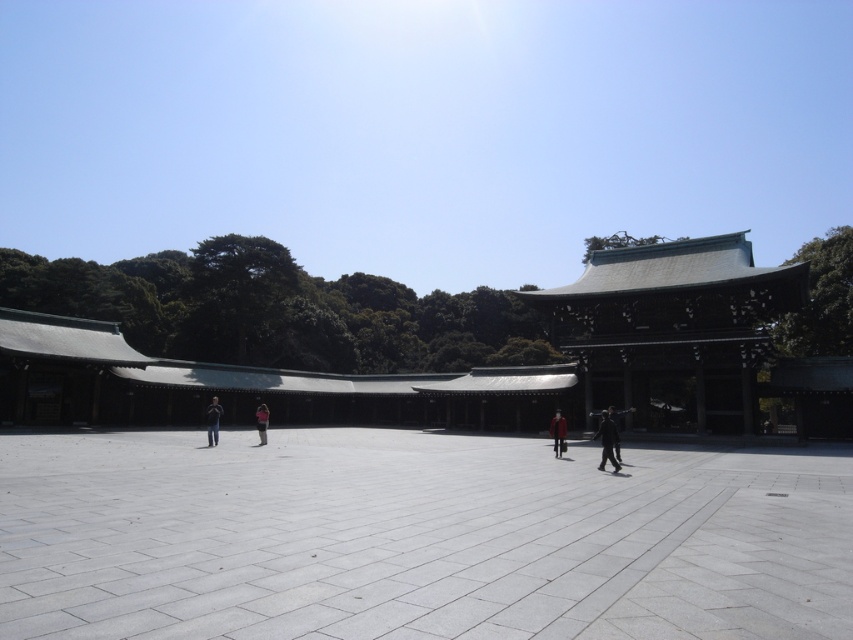
You are a photographer standing in the courtyard and want to capture both the dark gray fabric jacket at center and the red leather jacket at center in a single photo. Which jacket should you focus on first to ensure both are in frame?

The dark gray fabric jacket at center is above the red leather jacket at center, so focusing on the red leather jacket at center first will ensure both are within the frame as the dark gray one is positioned higher up.